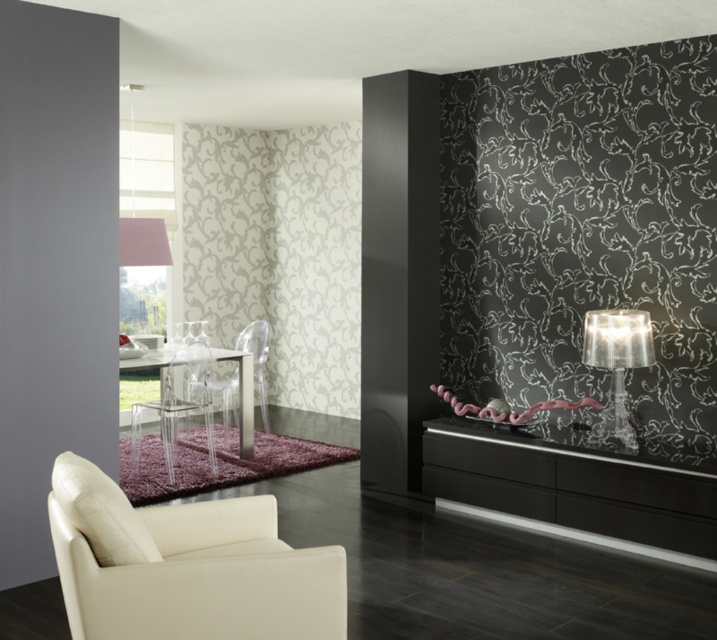
Which is more to the left, transparent plastic armchair at center or transparent plastic chair at center?

From the viewer's perspective, transparent plastic armchair at center appears more on the left side.

Between transparent plastic armchair at center and transparent plastic chair at center, which one has less height?

With less height is transparent plastic armchair at center.

Is point (138, 438) less distant than point (255, 332)?

Yes, point (138, 438) is in front of point (255, 332).

Locate an element on the screen. This screenshot has height=640, width=717. transparent plastic armchair at center is located at coordinates (179, 404).

Describe the element at coordinates (617, 364) in the screenshot. I see `clear glass table lamp at right` at that location.

Is clear glass table lamp at right below white fabric lampshade at upper left?

Correct, clear glass table lamp at right is located below white fabric lampshade at upper left.

This screenshot has width=717, height=640. What are the coordinates of `clear glass table lamp at right` in the screenshot? It's located at (617, 364).

Locate an element on the screen. Image resolution: width=717 pixels, height=640 pixels. clear glass table lamp at right is located at coordinates (617, 364).

Is beige leather armchair at lower left below black glossy cabinet at lower right?

Indeed, beige leather armchair at lower left is positioned under black glossy cabinet at lower right.

Can you confirm if beige leather armchair at lower left is positioned above black glossy cabinet at lower right?

Actually, beige leather armchair at lower left is below black glossy cabinet at lower right.

You are a GUI agent. You are given a task and a screenshot of the screen. Output one action in this format:
    pyautogui.click(x=<x>, y=<y>)
    Task: Click on the beige leather armchair at lower left
    This screenshot has width=717, height=640.
    Given the screenshot: What is the action you would take?
    pyautogui.click(x=185, y=566)